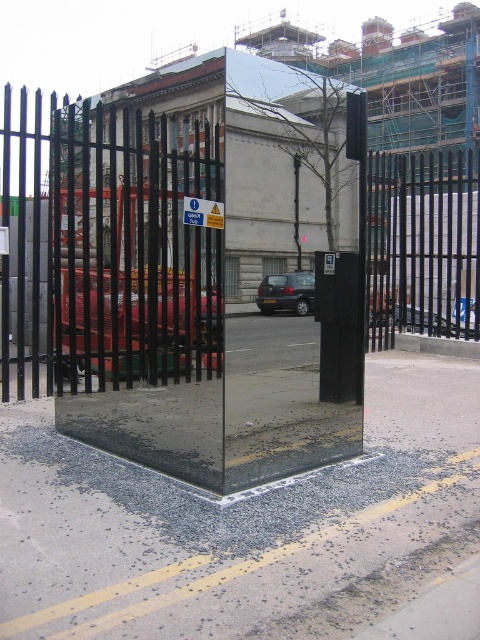
Who is positioned more to the left, metallic gate at center or dark gray metallic car at center?

metallic gate at center is more to the left.

Between point (72, 433) and point (274, 276), which one is positioned behind?

Positioned behind is point (72, 433).

Where is `metallic gate at center`? This screenshot has width=480, height=640. metallic gate at center is located at coordinates (142, 298).